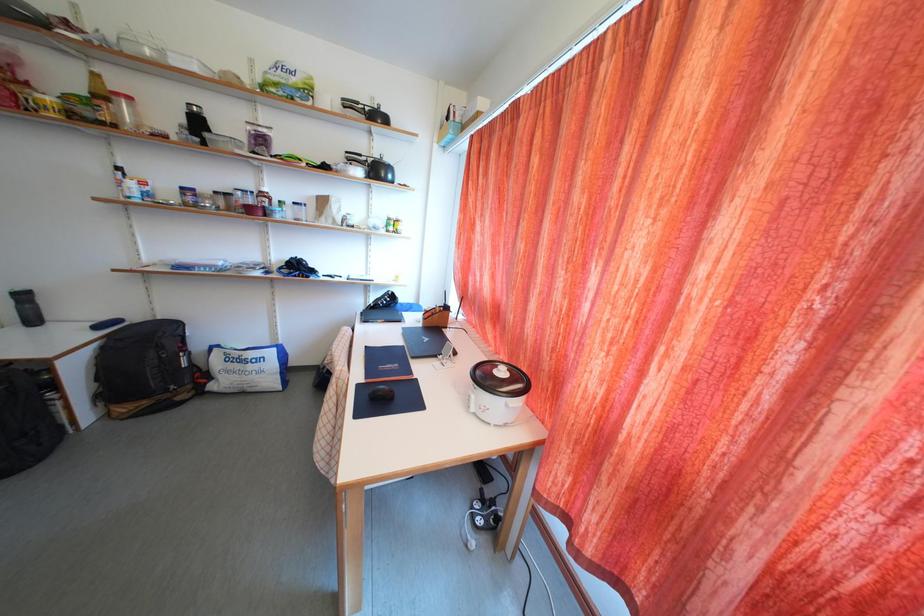
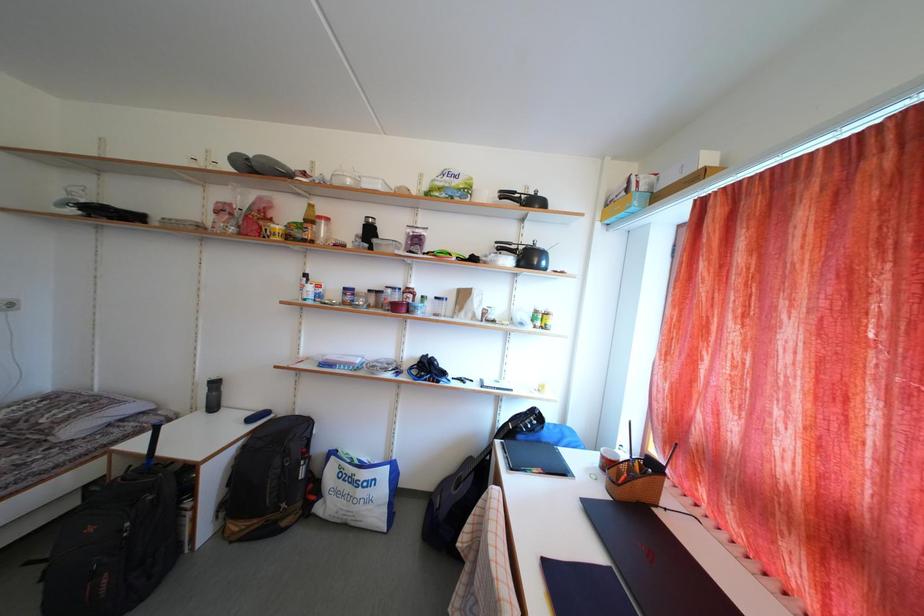
Based on the continuous images, in which direction is the camera rotating?

The rotation direction of the camera is left-up.